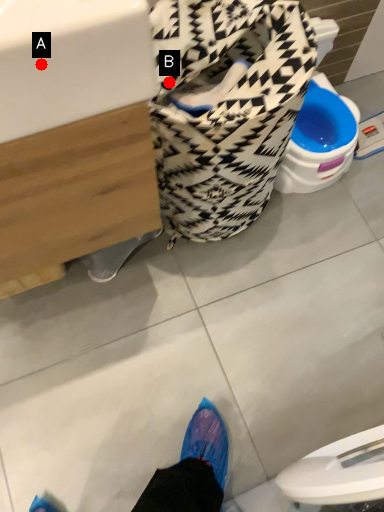
Question: Two points are circled on the image, labeled by A and B beside each circle. Which point is farther from the camera taking this photo?

Choices:
 (A) A is further
 (B) B is further

Answer: (B)